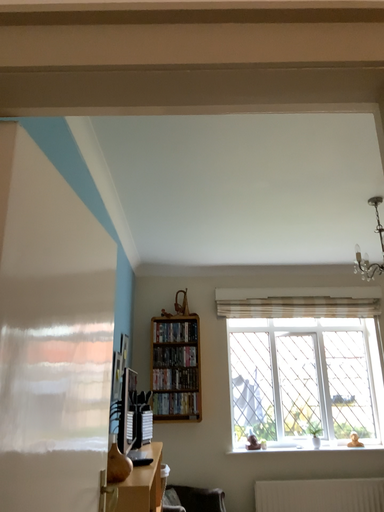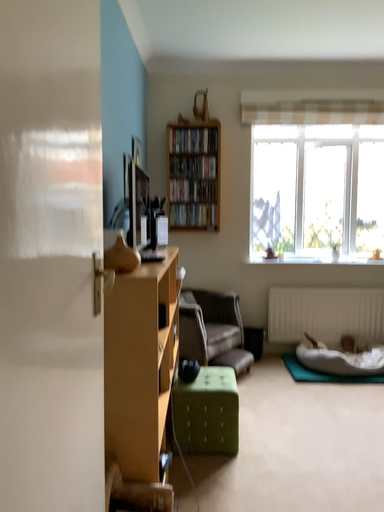
Question: How did the camera likely rotate when shooting the video?

Choices:
 (A) rotated upward
 (B) rotated downward

Answer: (B)